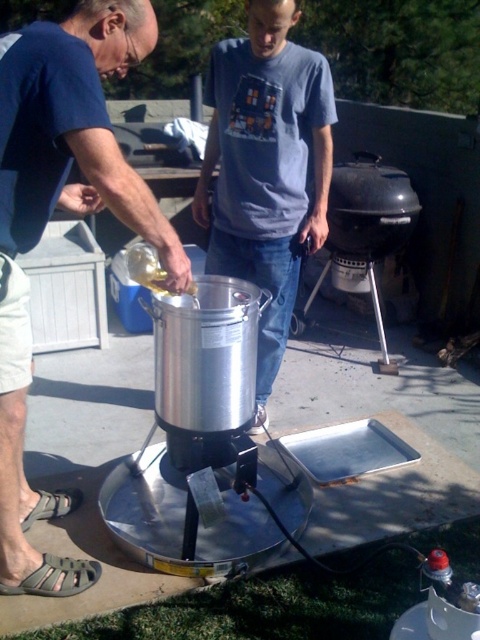
Question: Which point is closer to the camera?

Choices:
 (A) brushed metal pot at left
 (B) gray cotton shirt at center

Answer: (A)

Question: Observing the image, what is the correct spatial positioning of brushed metal pot at left in reference to gray cotton shirt at center?

Choices:
 (A) right
 (B) left

Answer: (B)

Question: Which point is farther to the camera?

Choices:
 (A) (56, 164)
 (B) (301, 68)

Answer: (B)

Question: Does brushed metal pot at left appear on the right side of gray cotton shirt at center?

Choices:
 (A) yes
 (B) no

Answer: (B)

Question: Which point is closer to the camera?

Choices:
 (A) (26, 157)
 (B) (261, 225)

Answer: (A)

Question: In this image, where is brushed metal pot at left located relative to gray cotton shirt at center?

Choices:
 (A) below
 (B) above

Answer: (A)